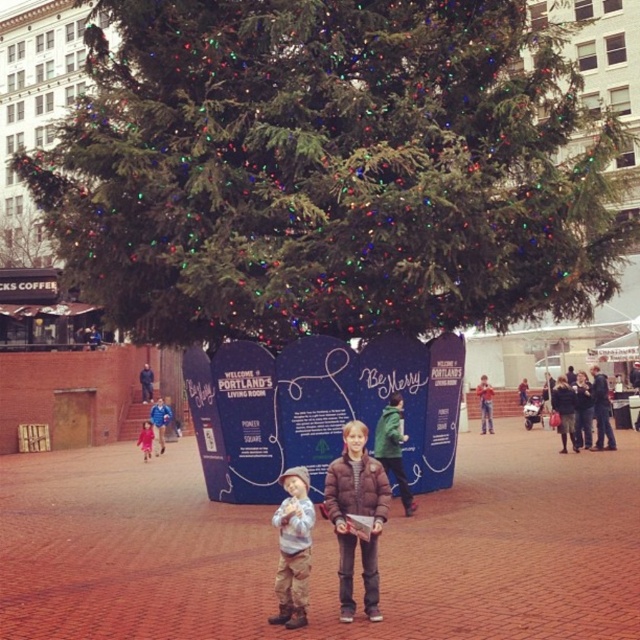
Question: Which object appears farthest from the camera in this image?

Choices:
 (A) green textured christmas tree at upper center
 (B) brown textured jacket at center
 (C) dark brown leather jacket at center
 (D) tan corduroy pants at center

Answer: (C)

Question: Does brown textured jacket at center have a lesser width compared to matte pink coat at left?

Choices:
 (A) no
 (B) yes

Answer: (B)

Question: Estimate the real-world distances between objects in this image. Which object is closer to the matte pink coat at left?

Choices:
 (A) green textured christmas tree at upper center
 (B) brown textured jacket at center

Answer: (B)

Question: Which object is the farthest from the tan corduroy pants at center?

Choices:
 (A) matte pink coat at left
 (B) dark brown leather jacket at center

Answer: (A)

Question: Is brown textured jacket at center in front of dark brown leather jacket at center?

Choices:
 (A) yes
 (B) no

Answer: (A)

Question: Is green textured christmas tree at upper center behind dark brown leather jacket at center?

Choices:
 (A) no
 (B) yes

Answer: (A)